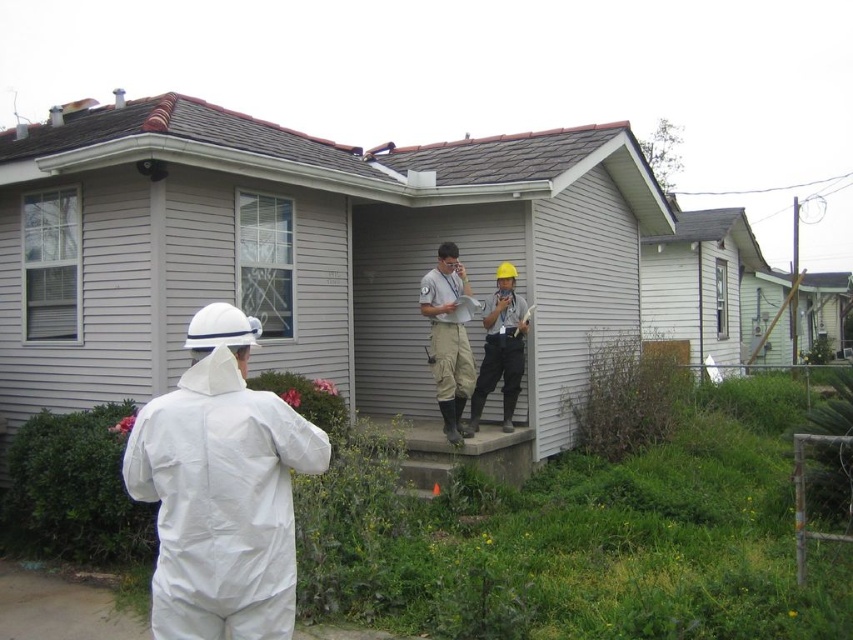
You are standing at the center of the image. Which direction should you move to reach the white matte suit at left?

Since the white matte suit at left is located at point 0.766 on the x and 0.260 on the y, you should move to the left direction to reach it.

You are a safety inspector arriving at the house. You notice the white matte suit at left and the hard hat at center. Which object takes up more space in the scene?

The hard hat at center takes up more space in the scene than the white matte suit at left.